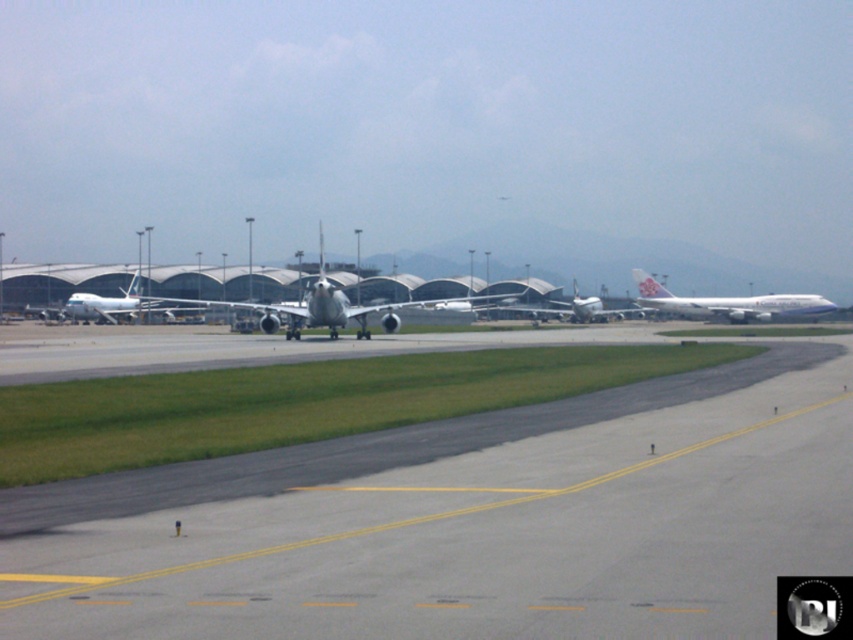
You are an airport maintenance worker needing to inspect both the white glossy airplane at center and the metallic silver airplane at center. Given their sizes, which airplane will require more time to inspect?

The white glossy airplane at center has a larger size compared to the metallic silver airplane at center, so it will require more time to inspect.

You are standing at the terminal entrance and want to walk to both points marked on the tarmac. Which point, point (704, 301) or point (83, 320), will you reach first?

You will reach point (83, 320) first because it is closer to you than point (704, 301), which is further away.

You are a pilot trying to determine the safest path for landing your plane. Based on the image, is the metallic silver airplane at center aligned with the gray asphalt runway at center for a proper landing?

The gray asphalt runway at center is positioned under the metallic silver airplane at center, indicating that the metallic silver airplane at center is properly aligned with the runway for landing.